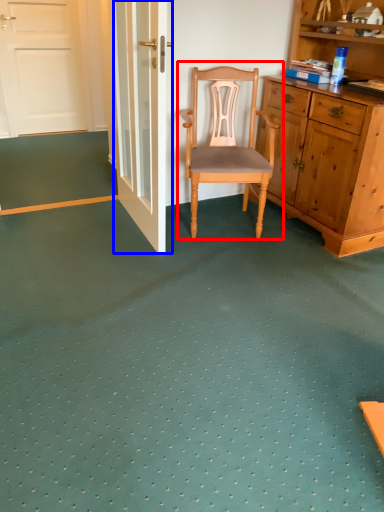
Question: Which object is further to the camera taking this photo, chair (highlighted by a red box) or door (highlighted by a blue box)?

Choices:
 (A) chair
 (B) door

Answer: (A)